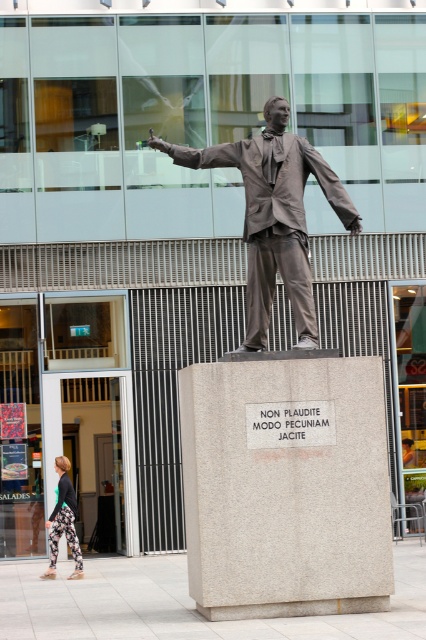
Looking at this image, can you confirm if bronze statue at center is positioned below floral leggings at lower left?

Incorrect, bronze statue at center is not positioned below floral leggings at lower left.

Does bronze statue at center have a lesser width compared to floral leggings at lower left?

Incorrect, bronze statue at center's width is not less than floral leggings at lower left's.

Locate an element on the screen. Image resolution: width=426 pixels, height=640 pixels. bronze statue at center is located at coordinates (273, 216).